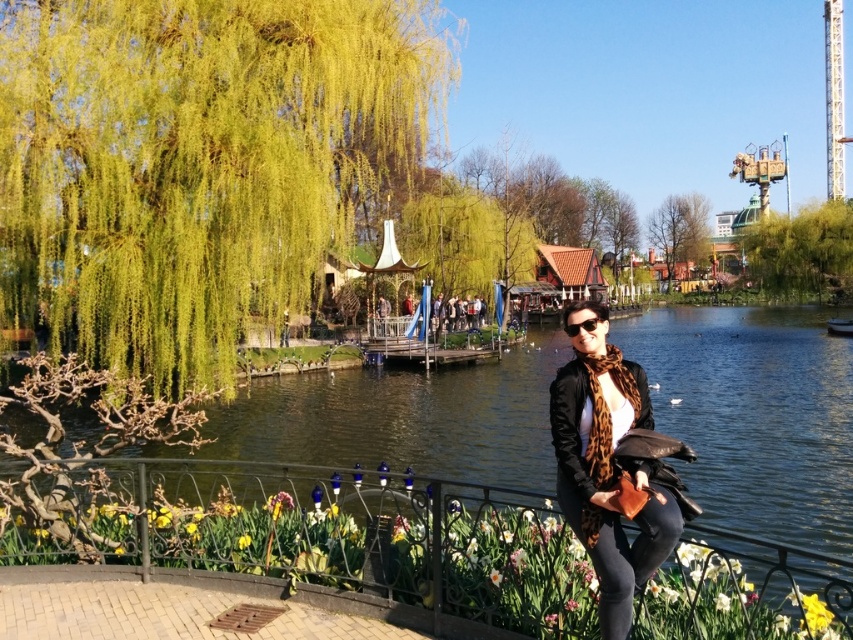
Measure the distance between green leafy willow at upper left and green leafy tree at upper center.

green leafy willow at upper left and green leafy tree at upper center are 588.07 feet apart.

Does green leafy willow at upper left lie in front of green leafy tree at upper center?

Yes, it is in front of green leafy tree at upper center.

Who is more forward, (1, 209) or (682, 236)?

Positioned in front is point (1, 209).

Where is `green leafy willow at upper left`? Image resolution: width=853 pixels, height=640 pixels. green leafy willow at upper left is located at coordinates (196, 163).

Locate an element on the screen. The width and height of the screenshot is (853, 640). leopard print scarf at center is located at coordinates (608, 472).

Which is behind, point (584, 531) or point (672, 211)?

Point (672, 211)

Identify the location of leopard print scarf at center. (608, 472).

Is point (625, 552) positioned before point (784, 214)?

That is True.

Locate an element on the screen. leopard print scarf at center is located at coordinates [x=608, y=472].